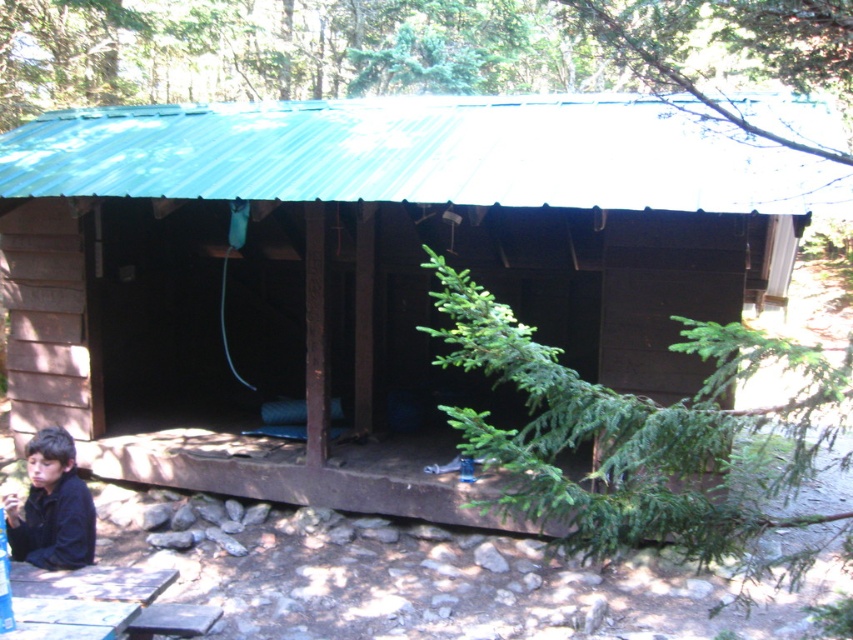
You are standing outside the green corrugated metal cabin at center and want to throw a ball to your friend who is standing 5 meters away from you. Can you reach your friend with the throw?

The distance between you and your friend is 5 meters, which is less than the 6.02 meters between you and the green corrugated metal cabin at center. Since the cabin is farther away than your friend, you can successfully throw the ball to your friend without the cabin obstructing the path.

You are planning to set up a small campsite near the wooden picnic table at lower left and the black matte jacket at lower left. Considering their positions, which object is closer to the cabin?

The wooden picnic table at lower left is closer to the cabin than the black matte jacket at lower left because the jacket is partially obscured by the cabin shadow, indicating it is farther away.

Consider the image. Based on the scene description, what are the coordinates of the green corrugated metal cabin at center?

The green corrugated metal cabin at center is located at coordinates point (364, 272).